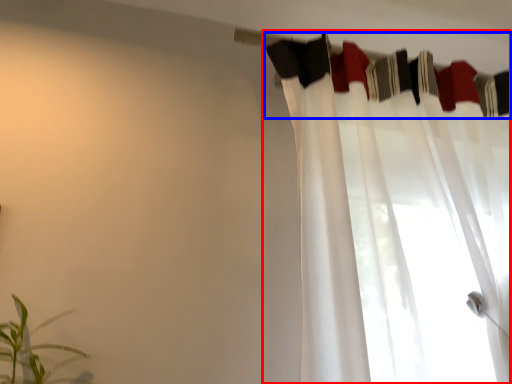
Question: Which object is closer to the camera taking this photo, curtain (highlighted by a red box) or clothesline (highlighted by a blue box)?

Choices:
 (A) curtain
 (B) clothesline

Answer: (A)